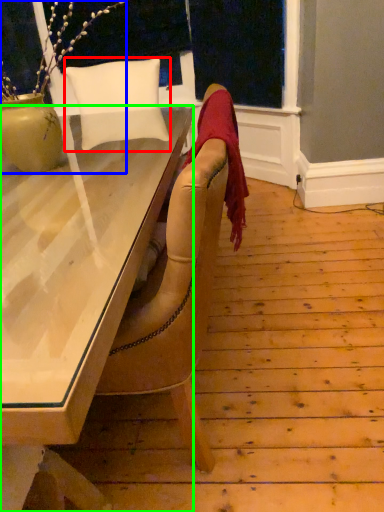
Question: Which object is positioned closest to pillow (highlighted by a red box)? Select from houseplant (highlighted by a blue box) and desk (highlighted by a green box).

Choices:
 (A) houseplant
 (B) desk

Answer: (A)